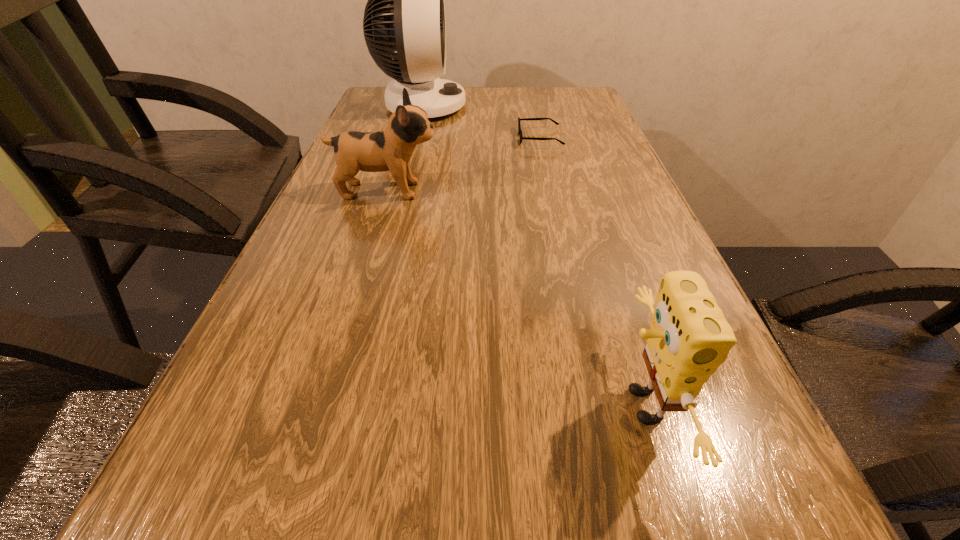
In the image, there is a desktop. Where is `vacant area at the far edge`? The width and height of the screenshot is (960, 540). vacant area at the far edge is located at coordinates [x=526, y=88].

You are a GUI agent. You are given a task and a screenshot of the screen. Output one action in this format:
    pyautogui.click(x=<x>, y=<y>)
    Task: Click on the free space at the left edge of the desktop
    The height and width of the screenshot is (540, 960).
    Given the screenshot: What is the action you would take?
    pyautogui.click(x=317, y=266)

The width and height of the screenshot is (960, 540). Find the location of `vacant area at the right edge`. vacant area at the right edge is located at coordinates (580, 197).

You are a GUI agent. You are given a task and a screenshot of the screen. Output one action in this format:
    pyautogui.click(x=<x>, y=<y>)
    Task: Click on the vacant region at the far right corner
    This screenshot has width=960, height=540.
    Given the screenshot: What is the action you would take?
    pyautogui.click(x=598, y=112)

The height and width of the screenshot is (540, 960). I want to click on blank region between the third farthest object and the shortest object, so [463, 164].

Identify the location of free spot between the nearest object and the shortest object. [591, 272].

Where is `free space that is in between the third farthest object and the sponge`? This screenshot has width=960, height=540. free space that is in between the third farthest object and the sponge is located at coordinates (514, 298).

Find the location of a particular element. vacant region between the sponge and the second nearest object is located at coordinates (514, 298).

In order to click on unoccupied position between the second nearest object and the sponge in this screenshot , I will do `click(514, 298)`.

Identify the location of free space between the tallest object and the sunglasses. The image size is (960, 540). (481, 122).